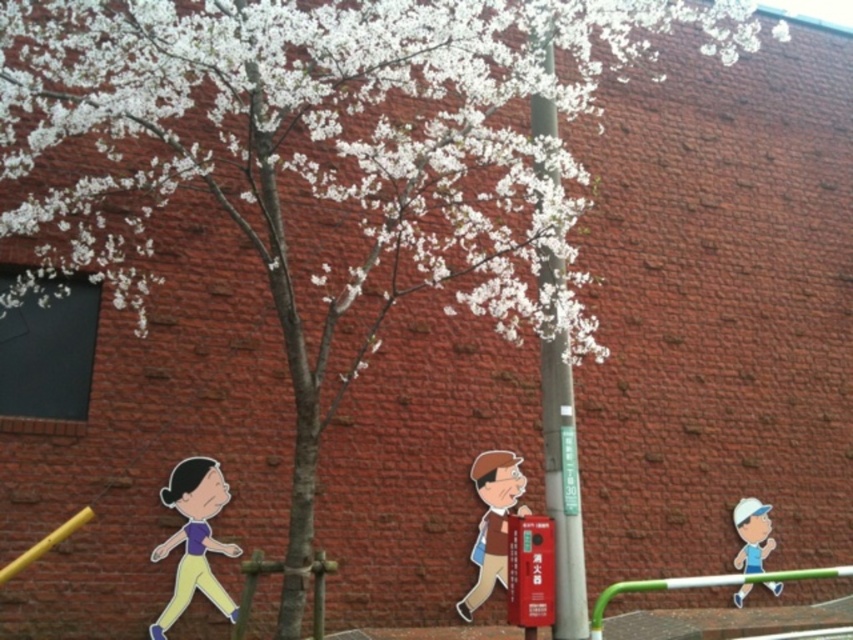
Does purple matte shirt at lower left lie in front of brown paper bag at center?

Yes, purple matte shirt at lower left is closer to the viewer.

Does purple matte shirt at lower left appear under brown paper bag at center?

Incorrect, purple matte shirt at lower left is not positioned below brown paper bag at center.

Where is `purple matte shirt at lower left`? The height and width of the screenshot is (640, 853). purple matte shirt at lower left is located at coordinates (194, 538).

Is brown paper bag at center positioned before matte blue cap at lower right?

Yes, brown paper bag at center is in front of matte blue cap at lower right.

Based on the photo, does brown paper bag at center have a lesser height compared to matte blue cap at lower right?

No, brown paper bag at center is not shorter than matte blue cap at lower right.

The image size is (853, 640). What are the coordinates of `brown paper bag at center` in the screenshot? It's located at (491, 524).

Can you confirm if purple matte shirt at lower left is positioned to the left of matte blue cap at lower right?

Yes, purple matte shirt at lower left is to the left of matte blue cap at lower right.

Who is positioned more to the left, purple matte shirt at lower left or matte blue cap at lower right?

From the viewer's perspective, purple matte shirt at lower left appears more on the left side.

Does point (216, 467) come behind point (761, 557)?

No, (216, 467) is closer to viewer.

Locate an element on the screen. purple matte shirt at lower left is located at coordinates (194, 538).